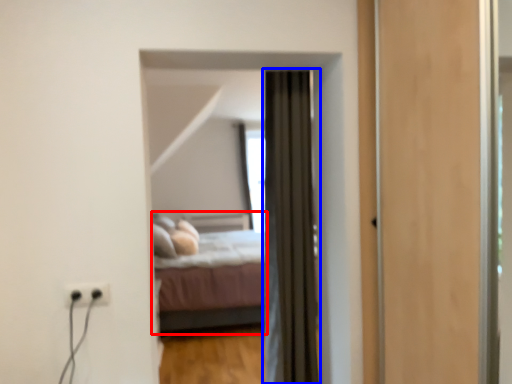
Question: Which point is further to the camera, bed (highlighted by a red box) or curtain (highlighted by a blue box)?

Choices:
 (A) bed
 (B) curtain

Answer: (A)